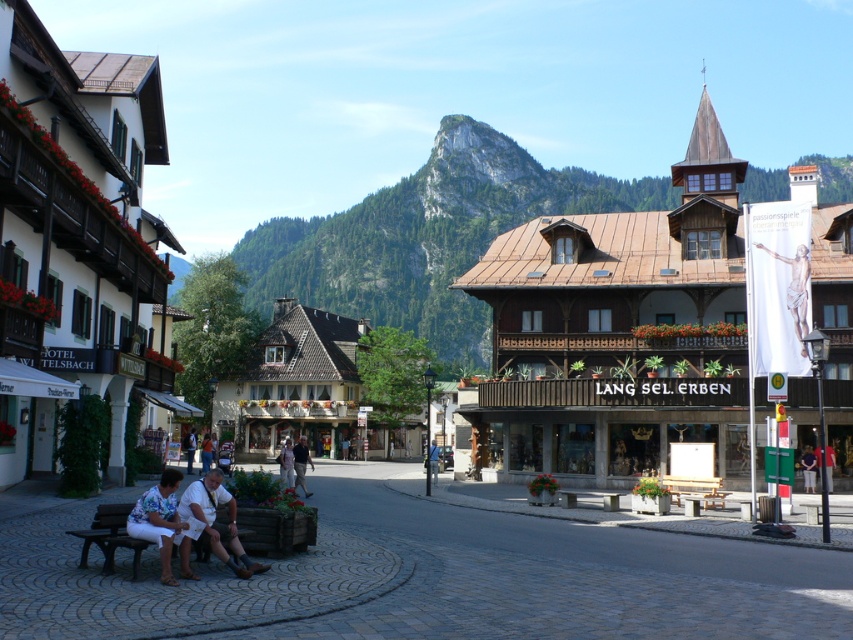
Question: Observing the image, what is the correct spatial positioning of rugged rock at center in reference to dark gray pants at center?

Choices:
 (A) above
 (B) below

Answer: (A)

Question: Which point is closer to the camera taking this photo?

Choices:
 (A) (183, 438)
 (B) (221, 472)
 (C) (804, 456)
 (D) (283, 458)

Answer: (B)

Question: Considering the real-world distances, which object is farthest from the dark gray pants at center?

Choices:
 (A) light brown leather jacket at center
 (B) green fabric shirt at center
 (C) white cotton pants at lower left

Answer: (B)

Question: Which point is farther to the camera?

Choices:
 (A) (190, 444)
 (B) (102, 531)
 (C) (706, 492)
 (D) (283, 474)

Answer: (A)

Question: Where is green fabric shirt at center located in relation to white cotton shirt at lower left in the image?

Choices:
 (A) left
 (B) right

Answer: (B)

Question: Does green fabric shirt at center have a larger size compared to dark blue jeans at lower center?

Choices:
 (A) yes
 (B) no

Answer: (B)